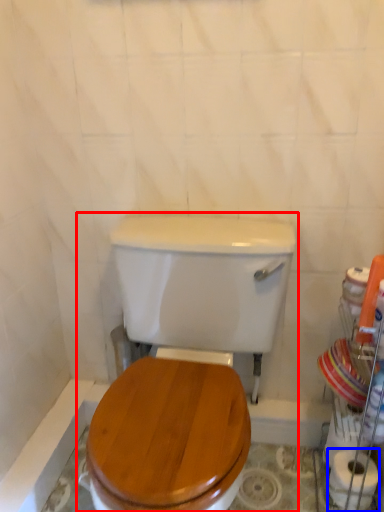
Question: Which object is closer to the camera taking this photo, toilet (highlighted by a red box) or toilet paper (highlighted by a blue box)?

Choices:
 (A) toilet
 (B) toilet paper

Answer: (A)